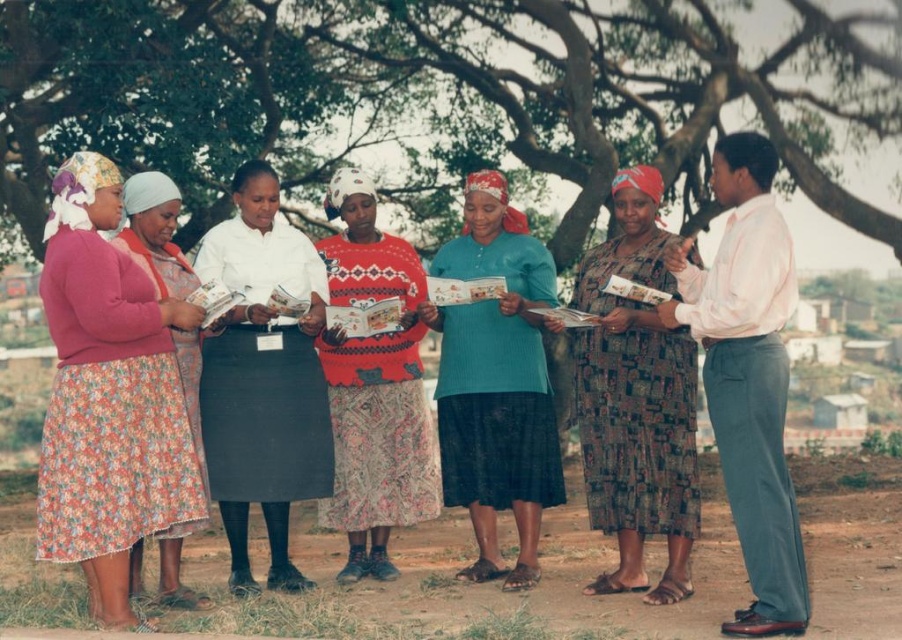
In the scene shown: You are a photographer trying to capture a closeup of the white matte skirt at center and the teal knitted sweater at center. Since the camera can only focus on one object at a time, which one should you focus on first to ensure it appears larger in the photo?

The white matte skirt at center is taller than the teal knitted sweater at center, so focusing on the white matte skirt at center first will ensure it appears larger in the photo.

You are a photographer standing in front of the group of people under the large tree. You notice two points marked in the scene. The first point is at coordinates point (284, 349) and the second is at point (666, 336). Which point is closer to you?

Point (284, 349) is closer to you because it is further to the viewer than point (666, 336).